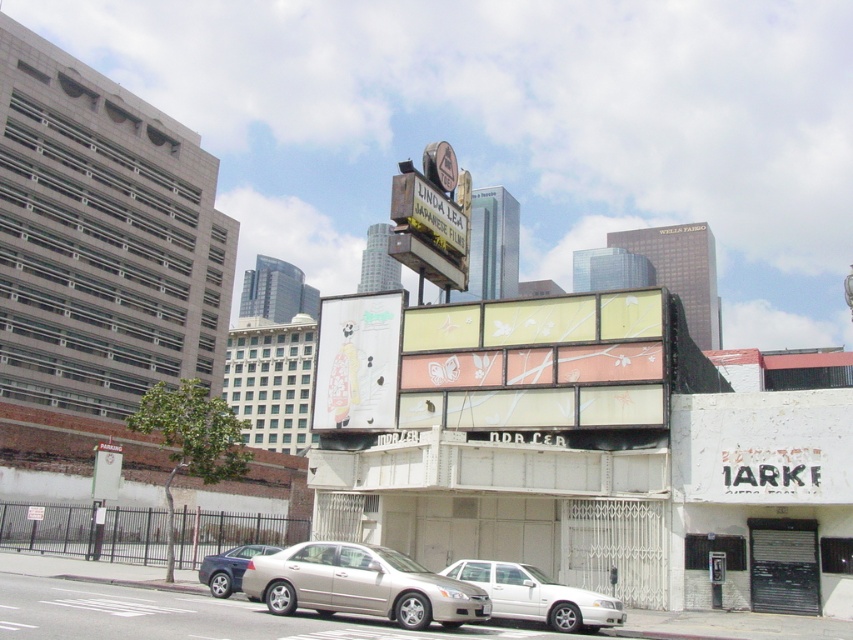
You are standing at the point marked as point (x=537, y=595). What object is located exactly at that point?

The silver metallic sedan at lower center is located exactly at point (x=537, y=595).

You are a delivery person who needs to park a 4.5 meter long truck between the metallic silver sedan at center and the silver metallic sedan at lower center. Can you fit the truck in the space between them?

The metallic silver sedan at center and silver metallic sedan at lower center are 4.66 meters apart from each other. Since the truck is 4.5 meters long, it can fit in the space between them as the distance is slightly larger than the truck.